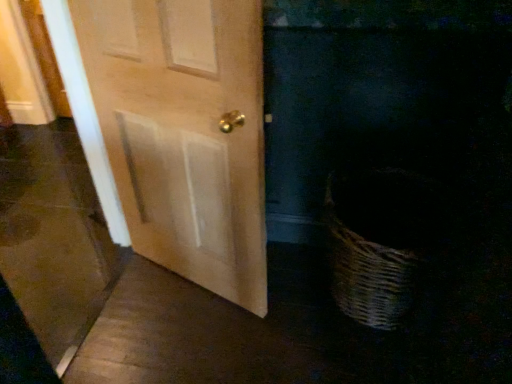
The image size is (512, 384). I want to click on light wood door at center, so click(x=185, y=133).

Image resolution: width=512 pixels, height=384 pixels. Describe the element at coordinates (185, 133) in the screenshot. I see `light wood door at center` at that location.

What is the approximate width of matte wood screen door at left?

matte wood screen door at left is 8.86 inches in width.

The image size is (512, 384). What do you see at coordinates (54, 237) in the screenshot? I see `matte wood screen door at left` at bounding box center [54, 237].

What are the coordinates of `matte wood screen door at left` in the screenshot? It's located at (54, 237).

In order to click on light wood door at center in this screenshot , I will do `click(185, 133)`.

In the image, is light wood door at center on the left side or the right side of matte wood screen door at left?

light wood door at center is to the right of matte wood screen door at left.

Relative to matte wood screen door at left, is light wood door at center in front or behind?

Clearly, light wood door at center is behind matte wood screen door at left.

Which is in front, point (219, 175) or point (42, 150)?

Point (219, 175)

From the image's perspective, which one is positioned lower, light wood door at center or matte wood screen door at left?

From the image's view, matte wood screen door at left is below.

From a real-world perspective, which object rests below the other?

From a 3D spatial view, matte wood screen door at left is below.

Looking at their sizes, would you say light wood door at center is wider or thinner than matte wood screen door at left?

light wood door at center is thinner than matte wood screen door at left.

In the scene shown: Which of these two, light wood door at center or matte wood screen door at left, stands taller?

matte wood screen door at left.

Based on the photo, is light wood door at center smaller than matte wood screen door at left?

Correct, light wood door at center occupies less space than matte wood screen door at left.

Can we say light wood door at center lies outside matte wood screen door at left?

Absolutely, light wood door at center is external to matte wood screen door at left.

Is light wood door at center beside matte wood screen door at left?

light wood door at center and matte wood screen door at left are not in contact.

Is light wood door at center positioned with its back to matte wood screen door at left?

No, light wood door at center is not facing the opposite direction of matte wood screen door at left.

How many degrees apart are the facing directions of light wood door at center and matte wood screen door at left?

110 degrees.

Image resolution: width=512 pixels, height=384 pixels. In order to click on door above the matte wood screen door at left (from the image's perspective) in this screenshot , I will do `click(185, 133)`.

Consider the image. Considering the positions of objects matte wood screen door at left and light wood door at center in the image provided, who is more to the left, matte wood screen door at left or light wood door at center?

matte wood screen door at left is more to the left.

Is the depth of matte wood screen door at left less than that of light wood door at center?

Yes, matte wood screen door at left is closer to the camera.

Which is farther, (63, 352) or (205, 228)?

Point (63, 352)

From the image's perspective, is matte wood screen door at left over light wood door at center?

No, from the image's perspective, matte wood screen door at left is not over light wood door at center.

From a real-world perspective, which is physically below, matte wood screen door at left or light wood door at center?

From a 3D spatial view, matte wood screen door at left is below.

In the scene shown: Which of these two, matte wood screen door at left or light wood door at center, is wider?

With larger width is matte wood screen door at left.

Between matte wood screen door at left and light wood door at center, which one has more height?

matte wood screen door at left.

Can you confirm if matte wood screen door at left is smaller than light wood door at center?

Incorrect, matte wood screen door at left is not smaller in size than light wood door at center.

Is light wood door at center located within matte wood screen door at left?

No, light wood door at center is located outside of matte wood screen door at left.

Is matte wood screen door at left beside light wood door at center?

No, matte wood screen door at left is not touching light wood door at center.

Consider the image. Is matte wood screen door at left positioned with its back to light wood door at center?

Yes, matte wood screen door at left is positioned with its back facing light wood door at center.

Can you tell me how much matte wood screen door at left and light wood door at center differ in facing direction?

matte wood screen door at left and light wood door at center are facing 110 degrees away from each other.

This screenshot has height=384, width=512. I want to click on screen door on the left of light wood door at center, so click(x=54, y=237).

In order to click on screen door below the light wood door at center (from a real-world perspective) in this screenshot , I will do `click(54, 237)`.

In the image, there is a light wood door at center. Identify the location of screen door below it (from the image's perspective). This screenshot has height=384, width=512. (54, 237).